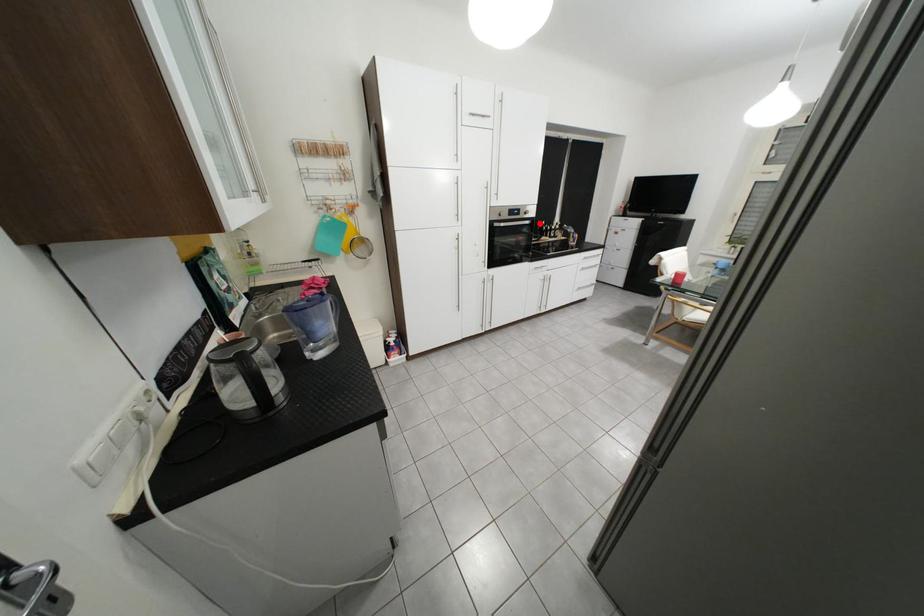
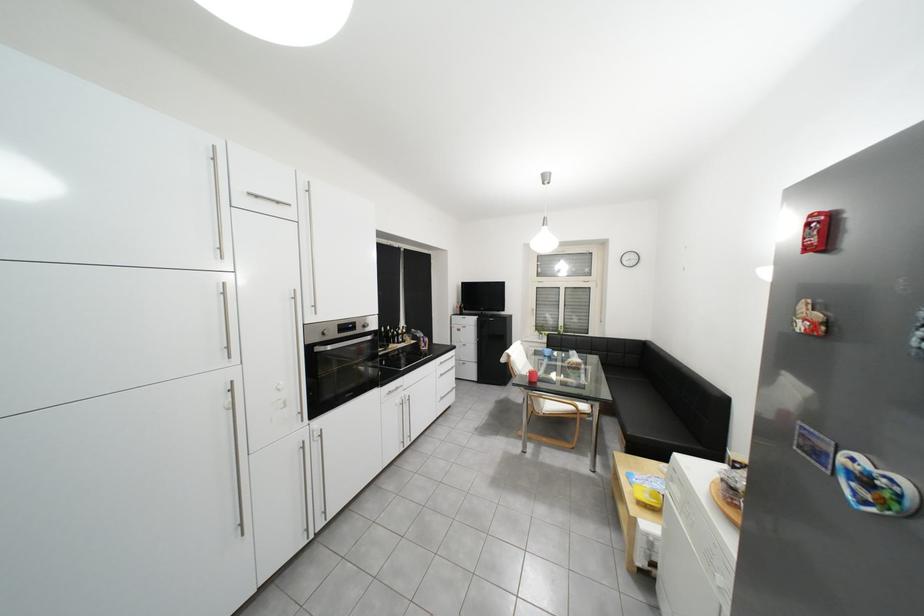
Question: I am providing you with two images of the same scene from different viewpoints. Given a red point in image1, look at the same physical point in image2. Is it:

Choices:
 (A) Closer to the viewpoint
 (B) Farther from the viewpoint

Answer: (B)